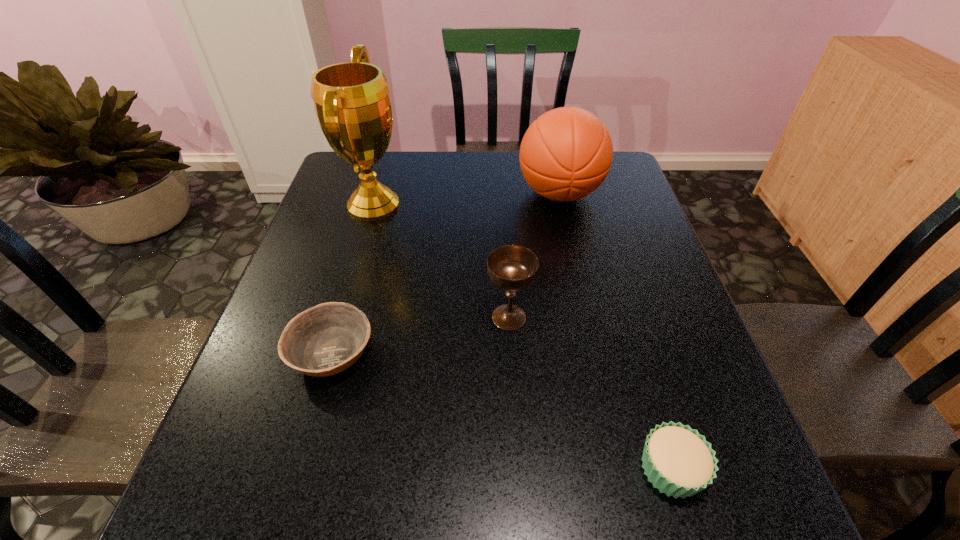
Locate an element on the screen. free space between the nearest object and the basketball is located at coordinates (615, 331).

Identify the location of vacant space in between the bowl and the cupcake. (502, 410).

What are the coordinates of `vacant area between the nearest object and the basketball` in the screenshot? It's located at (615, 331).

Locate an element on the screen. The height and width of the screenshot is (540, 960). vacant area that lies between the cupcake and the chalice is located at coordinates (590, 393).

You are a GUI agent. You are given a task and a screenshot of the screen. Output one action in this format:
    pyautogui.click(x=<x>, y=<y>)
    Task: Click on the vacant area that lies between the nearest object and the third shortest object
    This screenshot has width=960, height=540.
    Given the screenshot: What is the action you would take?
    pyautogui.click(x=590, y=393)

Identify the location of free space between the award and the bowl. (353, 279).

Identify the location of vacant point located between the second tallest object and the nearest object. Image resolution: width=960 pixels, height=540 pixels. (615, 331).

Where is `object that is the fourth nearest to the cupcake`? The height and width of the screenshot is (540, 960). object that is the fourth nearest to the cupcake is located at coordinates (352, 103).

Locate an element on the screen. object that can be found as the closest to the fourth shortest object is located at coordinates (512, 268).

Locate an element on the screen. The height and width of the screenshot is (540, 960). vacant region that satisfies the following two spatial constraints: 1. on the front-facing side of the tallest object; 2. on the right side of the bowl is located at coordinates (331, 353).